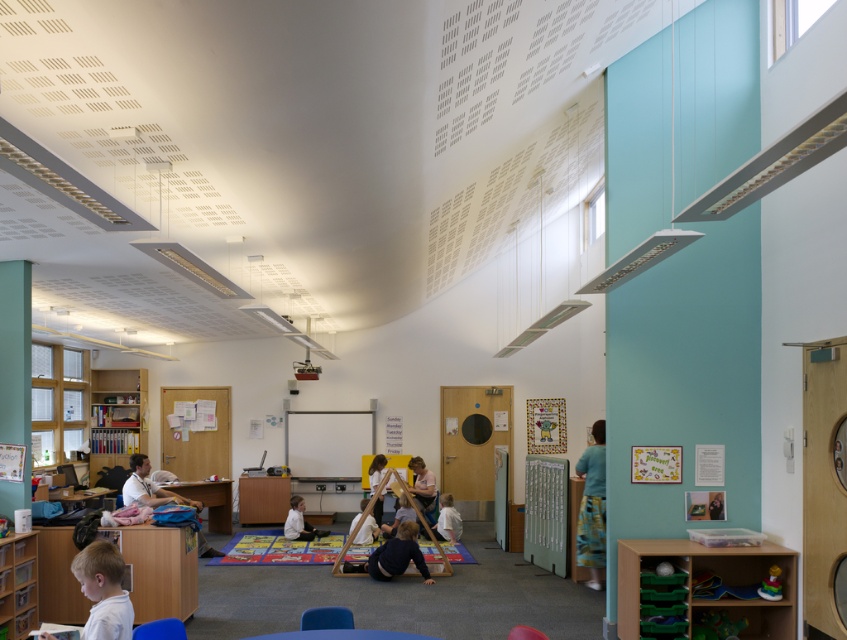
You are a teacher in the classroom and want to move a white fabric student at center to be closer to the rubberized plastic chair at lower center. How much distance do you need to reduce between them?

The white fabric student at center is currently 6.03 meters away from the rubberized plastic chair at lower center. To move them closer, you need to reduce the distance by 6.03 meters.